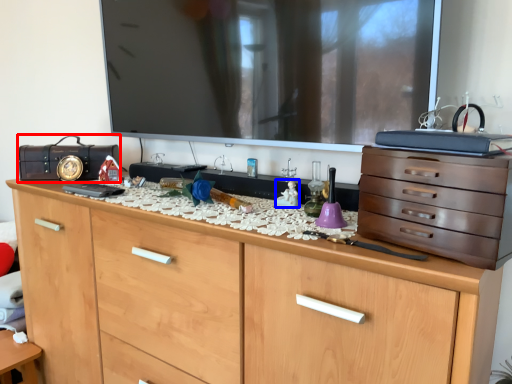
Question: Which object appears closest to the camera in this image, radio (highlighted by a red box) or toy (highlighted by a blue box)?

Choices:
 (A) radio
 (B) toy

Answer: (B)